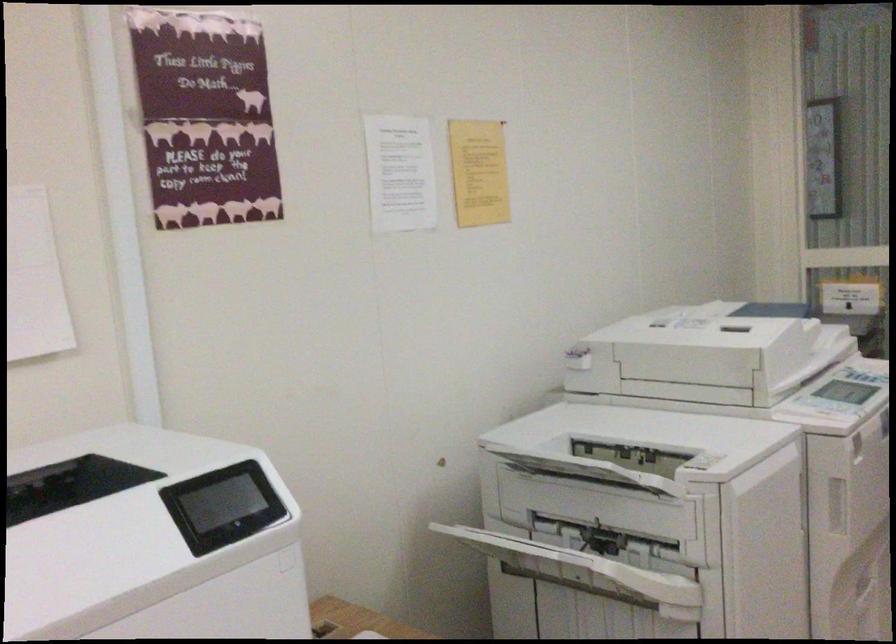
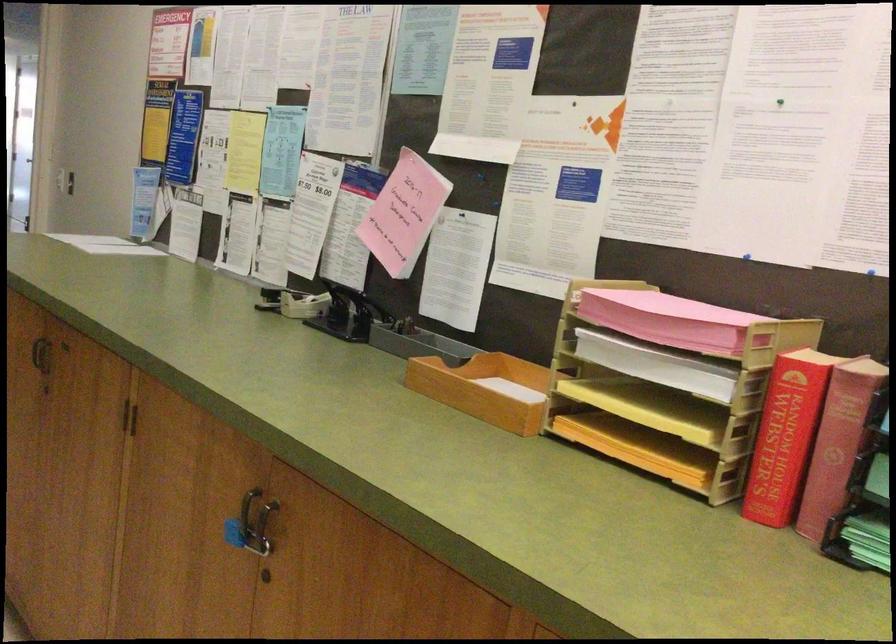
Question: Based on the continuous images, in which direction is the camera rotating? Reply with the corresponding letter.

Choices:
 (A) Left
 (B) Right
 (C) Up
 (D) Down

Answer: (B)